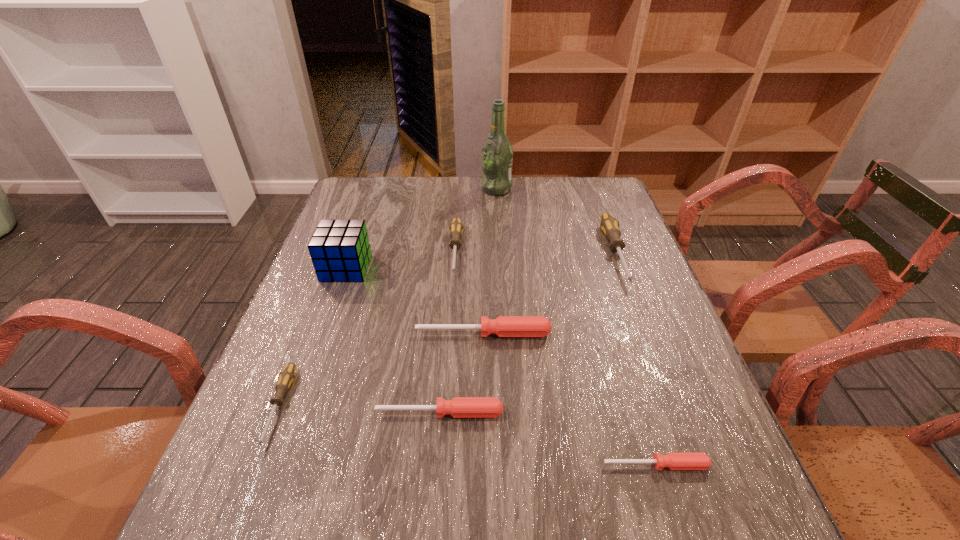
In order to click on free location that satisfies the following two spatial constraints: 1. at the tip of the nearest object; 2. on the right side of the second biggest gray screwdriver in this screenshot , I will do `click(441, 465)`.

This screenshot has height=540, width=960. What are the coordinates of `blank area in the image that satisfies the following two spatial constraints: 1. at the tip of the smallest gray screwdriver; 2. on the left side of the second farthest red screwdriver` in the screenshot? It's located at (276, 413).

Locate an element on the screen. vacant region that satisfies the following two spatial constraints: 1. on the surface of the green beer bottle; 2. on the back side of the nearest red screwdriver is located at coordinates (512, 465).